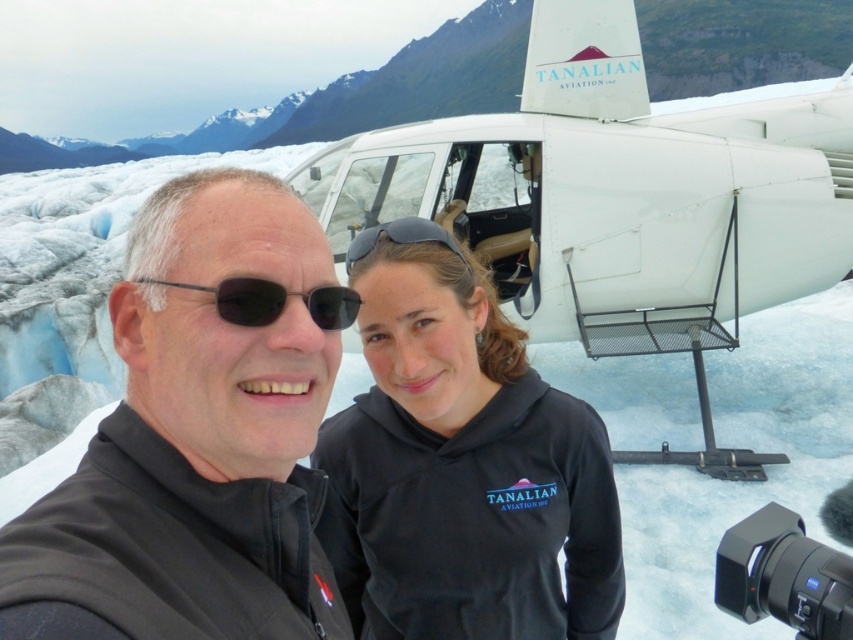
From the picture: Between black plastic video camera at lower right and black matte sunglasses at center, which one has more height?

black plastic video camera at lower right is taller.

Between point (840, 577) and point (465, 266), which one is positioned behind?

The point (465, 266) is more distant.

Find the location of a particular element. This screenshot has height=640, width=853. black plastic video camera at lower right is located at coordinates point(782,576).

Who is taller, black plastic sunglasses at left or black matte sunglasses at center?

black matte sunglasses at center is taller.

The image size is (853, 640). Identify the location of black plastic sunglasses at left. (273, 301).

Is the position of black fleece at center less distant than that of black plastic video camera at lower right?

That is False.

Can you confirm if black fleece at center is positioned above black plastic video camera at lower right?

Actually, black fleece at center is below black plastic video camera at lower right.

You are a GUI agent. You are given a task and a screenshot of the screen. Output one action in this format:
    pyautogui.click(x=<x>, y=<y>)
    Task: Click on the black fleece at center
    
    Given the screenshot: What is the action you would take?
    pyautogui.click(x=462, y=467)